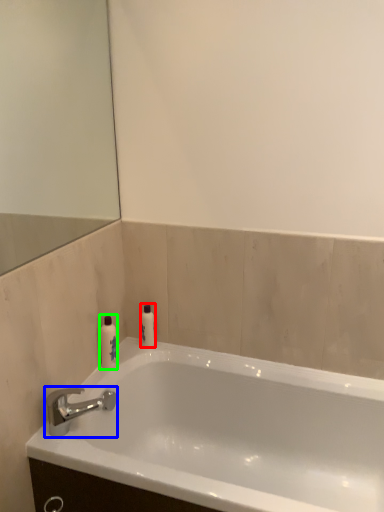
Question: Which is nearer to the toiletry (highlighted by a red box)? tap (highlighted by a blue box) or toiletry (highlighted by a green box).

Choices:
 (A) tap
 (B) toiletry

Answer: (B)